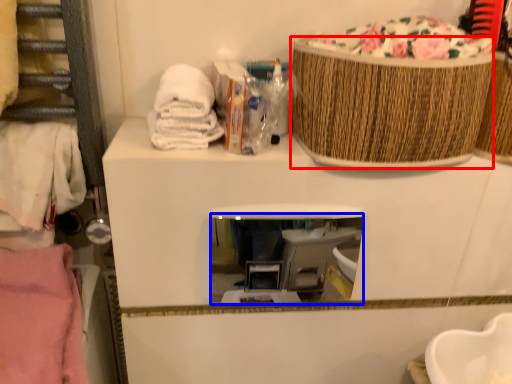
Question: Which object appears farthest to the camera in this image, basket (highlighted by a red box) or mirror (highlighted by a blue box)?

Choices:
 (A) basket
 (B) mirror

Answer: (B)